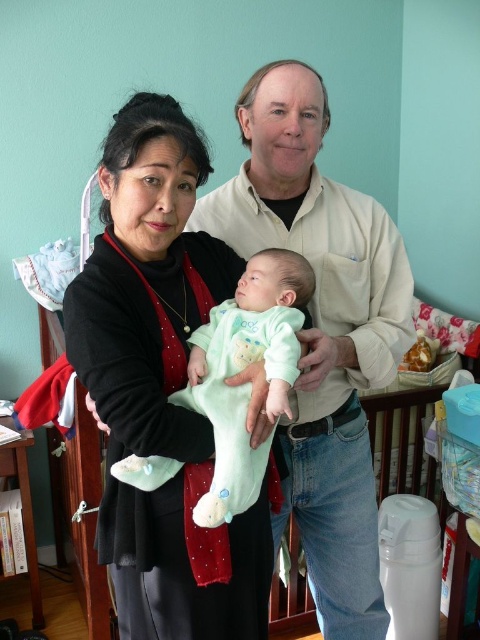
Question: Which object appears closest to the camera in this image?

Choices:
 (A) black matte sweater at center
 (B) light beige cotton shirt at center
 (C) light blue soft fabric baby at center

Answer: (C)

Question: Does black matte sweater at center have a larger size compared to light blue soft fabric baby at center?

Choices:
 (A) yes
 (B) no

Answer: (A)

Question: Is black matte sweater at center to the right of light blue soft fabric baby at center from the viewer's perspective?

Choices:
 (A) no
 (B) yes

Answer: (A)

Question: Which object is farther from the camera taking this photo?

Choices:
 (A) light blue soft fabric baby at center
 (B) light beige cotton shirt at center
 (C) black matte sweater at center

Answer: (B)

Question: Does black matte sweater at center appear under light beige cotton shirt at center?

Choices:
 (A) no
 (B) yes

Answer: (A)

Question: Which point is closer to the camera?

Choices:
 (A) light blue soft fabric baby at center
 (B) black matte sweater at center

Answer: (A)